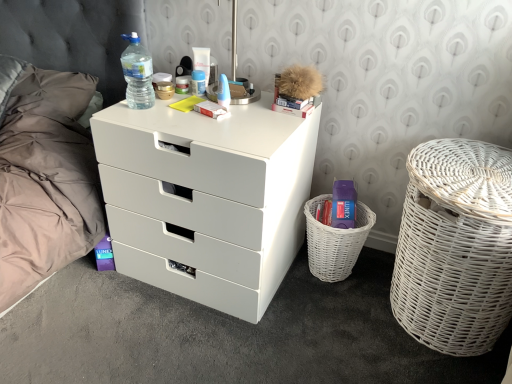
Question: Which direction should I rotate to look at blue plastic toothbrush at upper center, the 1th toiletry when ordered from right to left?

Choices:
 (A) right
 (B) left

Answer: (B)

Question: Considering the relative positions of matte plastic container at center, which appears as the 4th toiletry when viewed from the right, and white wicker basket at right in the image provided, is matte plastic container at center, which appears as the 4th toiletry when viewed from the right, to the right of white wicker basket at right from the viewer's perspective?

Choices:
 (A) no
 (B) yes

Answer: (A)

Question: Would you say white wicker basket at right is part of matte plastic container at center, which is counted as the 1th toiletry, starting from the left,'s contents?

Choices:
 (A) no
 (B) yes

Answer: (A)

Question: From the image's perspective, is matte plastic container at center, which is counted as the 1th toiletry, starting from the left, over white wicker basket at right?

Choices:
 (A) yes
 (B) no

Answer: (A)

Question: Is matte plastic container at center, which is counted as the 1th toiletry, starting from the left, thinner than white wicker basket at right?

Choices:
 (A) yes
 (B) no

Answer: (A)

Question: Could you tell me if matte plastic container at center, which appears as the 4th toiletry when viewed from the right, is turned towards white wicker basket at right?

Choices:
 (A) no
 (B) yes

Answer: (A)

Question: Is matte plastic container at center, which appears as the 4th toiletry when viewed from the right, far from white wicker basket at right?

Choices:
 (A) no
 (B) yes

Answer: (B)

Question: Considering the relative sizes of translucent plastic bottle at upper left and matte plastic container at center, which is counted as the 1th toiletry, starting from the left, in the image provided, is translucent plastic bottle at upper left wider than matte plastic container at center, which is counted as the 1th toiletry, starting from the left,?

Choices:
 (A) no
 (B) yes

Answer: (B)

Question: From a real-world perspective, does translucent plastic bottle at upper left sit lower than matte plastic container at center, which appears as the 4th toiletry when viewed from the right?

Choices:
 (A) yes
 (B) no

Answer: (B)

Question: Considering the relative sizes of translucent plastic bottle at upper left and matte plastic container at center, which is counted as the 1th toiletry, starting from the left, in the image provided, is translucent plastic bottle at upper left shorter than matte plastic container at center, which is counted as the 1th toiletry, starting from the left,?

Choices:
 (A) yes
 (B) no

Answer: (B)

Question: From the image's perspective, is translucent plastic bottle at upper left under matte plastic container at center, which appears as the 4th toiletry when viewed from the right?

Choices:
 (A) no
 (B) yes

Answer: (B)

Question: Is translucent plastic bottle at upper left outside of matte plastic container at center, which appears as the 4th toiletry when viewed from the right?

Choices:
 (A) no
 (B) yes

Answer: (B)

Question: From a real-world perspective, is translucent plastic bottle at upper left on top of matte plastic container at center, which is counted as the 1th toiletry, starting from the left?

Choices:
 (A) no
 (B) yes

Answer: (B)

Question: From the image's perspective, does white wicker basket at right appear higher than translucent plastic bottle at upper left?

Choices:
 (A) no
 (B) yes

Answer: (A)